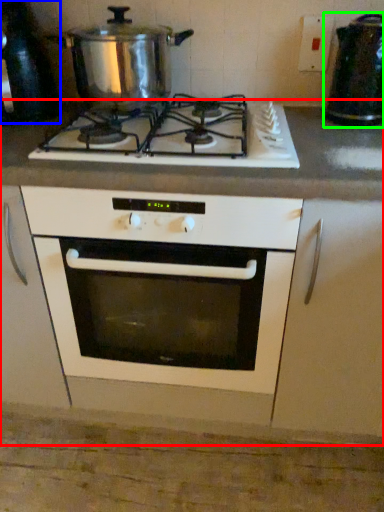
Question: Which object is the farthest from counter (highlighted by a red box)? Choose among these: appliance (highlighted by a blue box) or appliance (highlighted by a green box).

Choices:
 (A) appliance
 (B) appliance

Answer: (A)